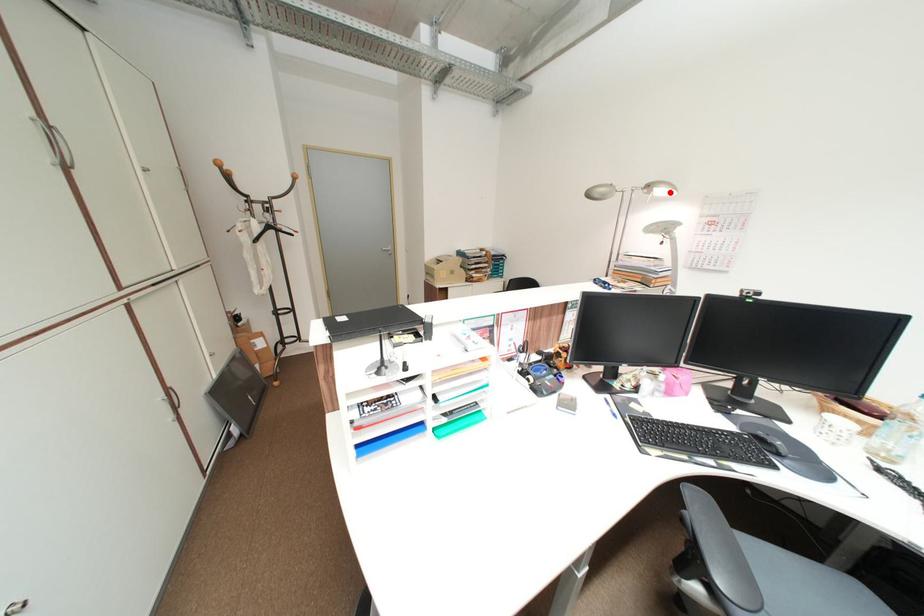
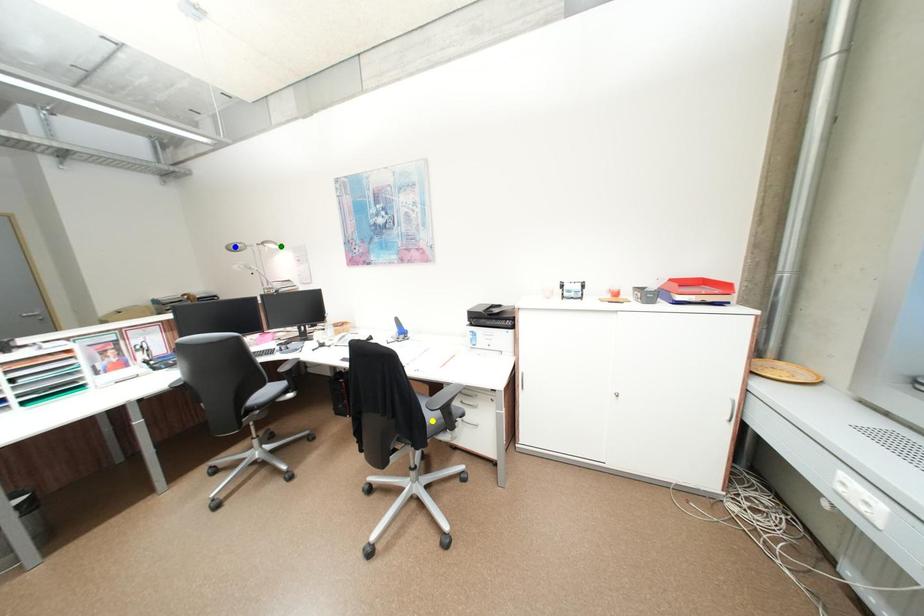
Question: I am providing you with two images of the same scene from different viewpoints. A red point is marked on the first image. You are given multiple points on the second image. Which mark in image 2 goes with the point in image 1?

Choices:
 (A) blue point
 (B) yellow point
 (C) green point

Answer: (C)